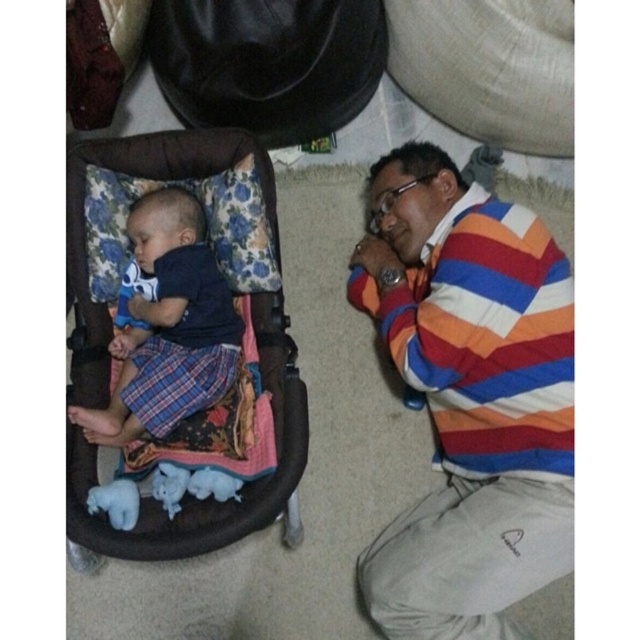
Based on the scene description, where is the striped cotton shirt at lower right located in terms of coordinates?

The striped cotton shirt at lower right is located at coordinates point [468,396].

Consider the image. You are a photographer setting up a shoot in this scene. You need to place a small prop between the brown fabric baby carriage at center and the matte blue shirt at left. Based on their positions, which object should the prop be closer to?

The brown fabric baby carriage at center is positioned on the left side of matte blue shirt at left. Therefore, the prop should be placed closer to the brown fabric baby carriage at center since it is already to the left of the matte blue shirt at left.

You are taking a photo of the scene and want to focus on both point (x=220, y=547) and point (x=156, y=189). Which point should you focus on first to ensure both are in sharp focus?

Point (x=220, y=547) is closer to the camera than point (x=156, y=189), so you should focus on point (x=220, y=547) first to ensure both are in sharp focus.